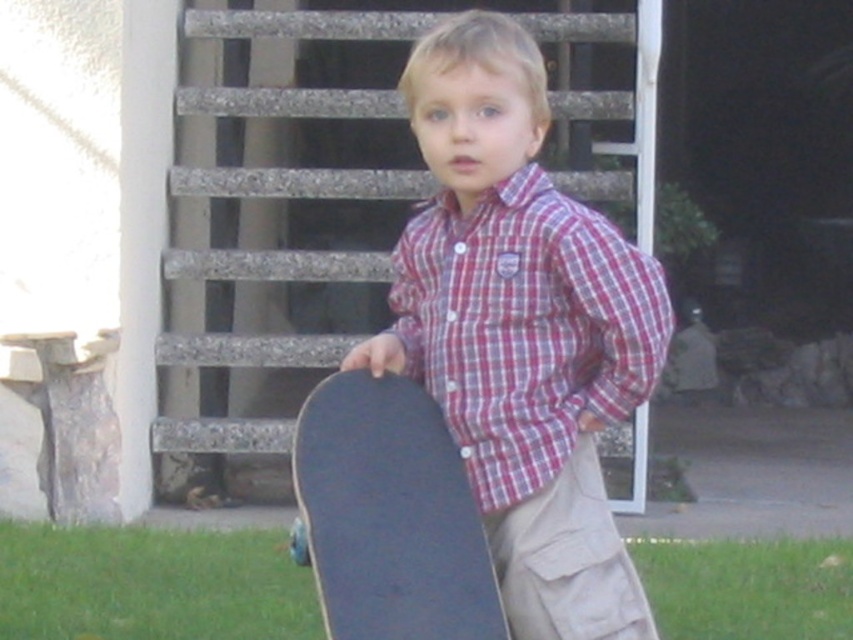
Question: Does plaid cotton shirt at center have a larger size compared to black matte skateboard at center?

Choices:
 (A) no
 (B) yes

Answer: (B)

Question: Is matte black skateboard at center thinner than khaki cotton pants at lower center?

Choices:
 (A) yes
 (B) no

Answer: (B)

Question: Which object is the farthest from the khaki cotton pants at lower center?

Choices:
 (A) matte black skateboard at center
 (B) green grass at lower center

Answer: (B)

Question: Is plaid cotton shirt at center behind black matte skateboard at center?

Choices:
 (A) no
 (B) yes

Answer: (B)

Question: Which point appears closest to the camera in this image?

Choices:
 (A) (670, 611)
 (B) (614, 570)
 (C) (397, 584)

Answer: (C)

Question: Which object is closer to the camera taking this photo?

Choices:
 (A) green grass at lower center
 (B) plaid cotton shirt at center
 (C) khaki cotton pants at lower center

Answer: (B)